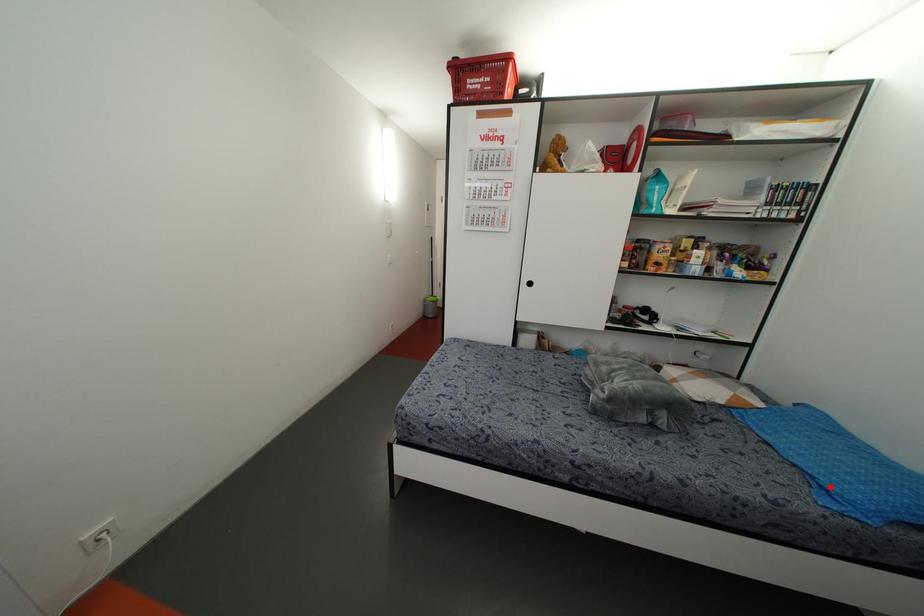
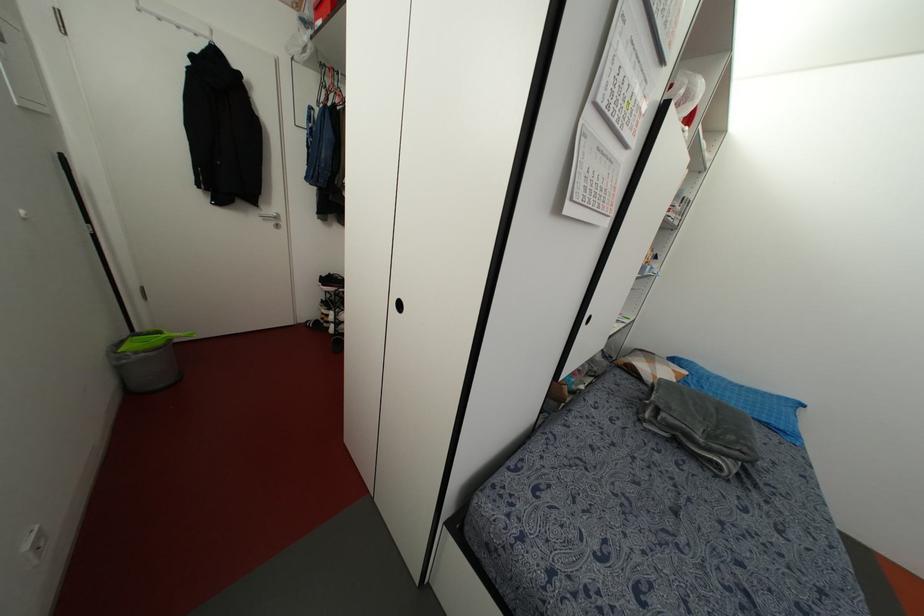
Locate, in the second image, the point that corresponds to the highlighted location in the first image.

(782, 427)